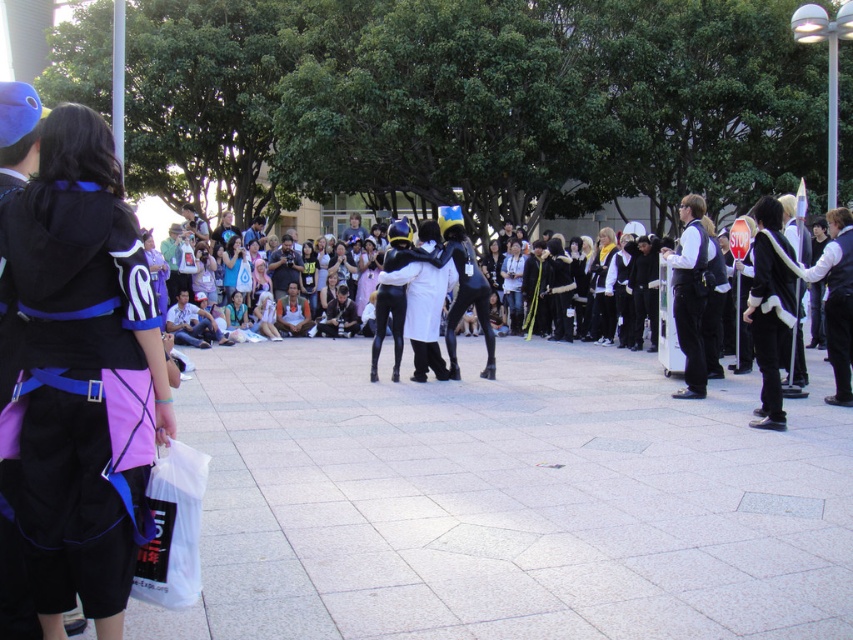
Does point (45, 408) lie in front of point (227, 250)?

Yes, point (45, 408) is in front of point (227, 250).

Consider the image. Can you confirm if matte black hoodie at left is shorter than matte black dress at center?

In fact, matte black hoodie at left may be taller than matte black dress at center.

Is point (120, 445) in front of point (228, 276)?

Yes, point (120, 445) is in front of point (228, 276).

The width and height of the screenshot is (853, 640). What are the coordinates of `matte black hoodie at left` in the screenshot? It's located at (80, 390).

In the scene shown: Between white matte vest at right and matte black dress at center, which one appears on the left side from the viewer's perspective?

Positioned to the left is matte black dress at center.

Does white matte vest at right appear on the left side of matte black dress at center?

No, white matte vest at right is not to the left of matte black dress at center.

Image resolution: width=853 pixels, height=640 pixels. In order to click on white matte vest at right in this screenshot , I will do `click(689, 292)`.

This screenshot has height=640, width=853. I want to click on white matte vest at right, so click(689, 292).

Is denim jeans at center to the left of light purple fabric dress at center from the viewer's perspective?

In fact, denim jeans at center is to the right of light purple fabric dress at center.

Which is more to the right, denim jeans at center or light purple fabric dress at center?

denim jeans at center

Who is more forward, (518, 273) or (202, 262)?

Point (202, 262) is in front.

You are a GUI agent. You are given a task and a screenshot of the screen. Output one action in this format:
    pyautogui.click(x=<x>, y=<y>)
    Task: Click on the denim jeans at center
    The height and width of the screenshot is (640, 853).
    Given the screenshot: What is the action you would take?
    pyautogui.click(x=514, y=284)